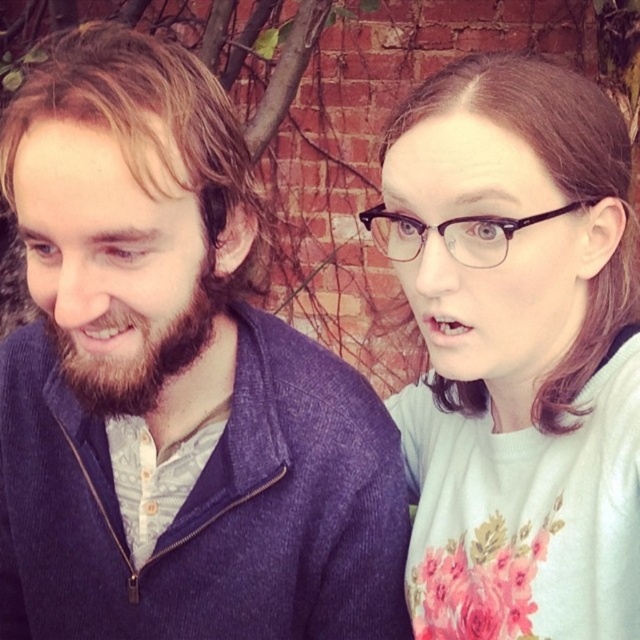
Question: Does brown smooth hair at upper right appear over dark brown fuzzy beard at left?

Choices:
 (A) yes
 (B) no

Answer: (A)

Question: Which point is closer to the camera?

Choices:
 (A) (586, 129)
 (B) (218, 545)

Answer: (A)

Question: Which point is closer to the camera?

Choices:
 (A) brown smooth hair at upper right
 (B) black plastic glasses at upper right
 (C) matte blue sweater at left

Answer: (B)

Question: Can you confirm if dark brown fuzzy beard at left is wider than black plastic glasses at upper right?

Choices:
 (A) no
 (B) yes

Answer: (A)

Question: Is brown smooth hair at upper right positioned behind black plastic glasses at upper right?

Choices:
 (A) yes
 (B) no

Answer: (A)

Question: Which point appears farthest from the camera in this image?

Choices:
 (A) (80, 394)
 (B) (252, 188)
 (C) (568, 164)

Answer: (B)